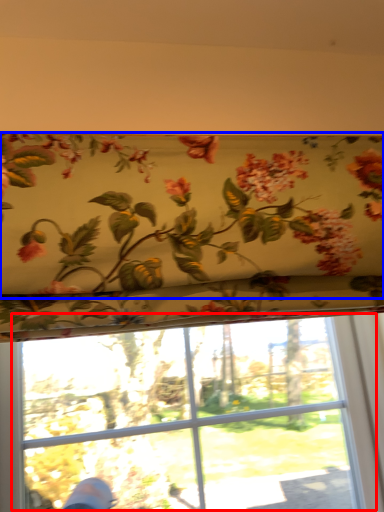
Question: Among these objects, which one is farthest to the camera, bay window (highlighted by a red box) or floral arrangement (highlighted by a blue box)?

Choices:
 (A) bay window
 (B) floral arrangement

Answer: (A)